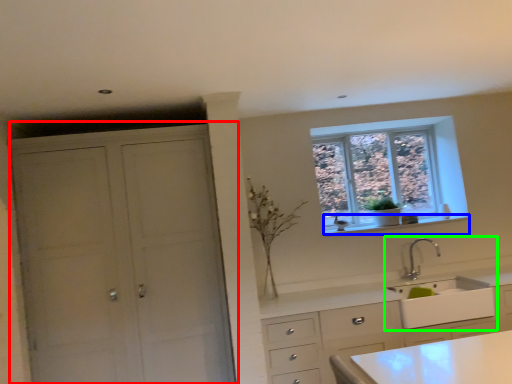
Question: Based on their relative distances, which object is nearer to cupboard (highlighted by a red box)? Choose from window sill (highlighted by a blue box) and sink (highlighted by a green box).

Choices:
 (A) window sill
 (B) sink

Answer: (A)